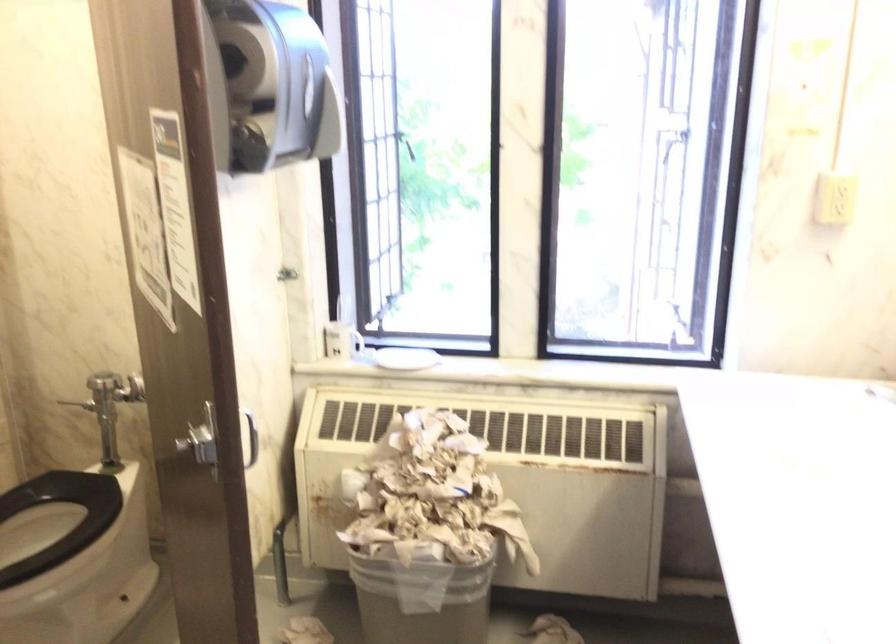
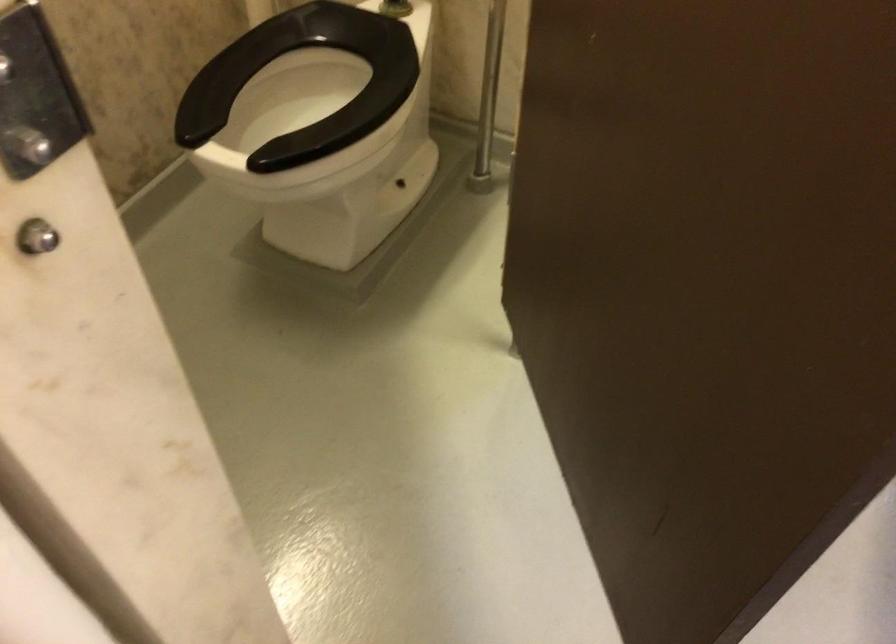
Question: Based on the continuous images, in which direction is the camera rotating? Reply with the corresponding letter.

Choices:
 (A) Left
 (B) Right
 (C) Up
 (D) Down

Answer: (D)